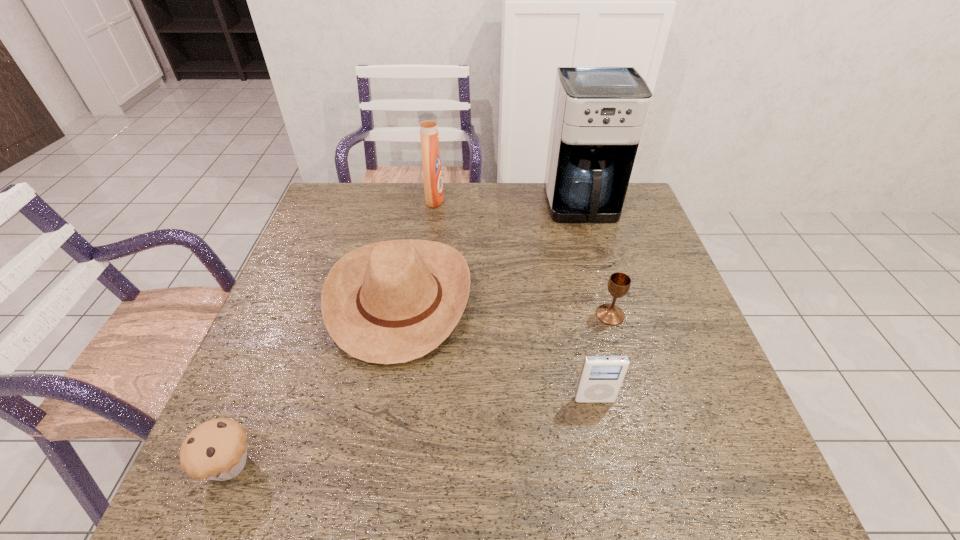
At what (x,y) coordinates should I click in order to perform the action: click on object that is at the near left corner. Please return your answer as a coordinate pair (x, y). Looking at the image, I should click on point(217,449).

What are the coordinates of `object that is at the far right corner` in the screenshot? It's located at (599, 112).

The height and width of the screenshot is (540, 960). Find the location of `free space at the far edge of the desktop`. free space at the far edge of the desktop is located at coordinates (490, 211).

In the image, there is a desktop. What are the coordinates of `vacant space at the near edge` in the screenshot? It's located at (325, 477).

Find the location of a particular element. vacant space at the left edge of the desktop is located at coordinates (268, 413).

This screenshot has height=540, width=960. Find the location of `vacant area at the right edge`. vacant area at the right edge is located at coordinates (630, 249).

Identify the location of vacant space at the far left corner of the desktop. (371, 186).

Locate an element on the screen. This screenshot has width=960, height=540. vacant space at the near left corner of the desktop is located at coordinates (239, 478).

The height and width of the screenshot is (540, 960). What are the coordinates of `free space between the detergent and the fifth farthest object` in the screenshot? It's located at (515, 299).

Where is `empty location between the cowboy hat and the tallest object`? The image size is (960, 540). empty location between the cowboy hat and the tallest object is located at coordinates (492, 253).